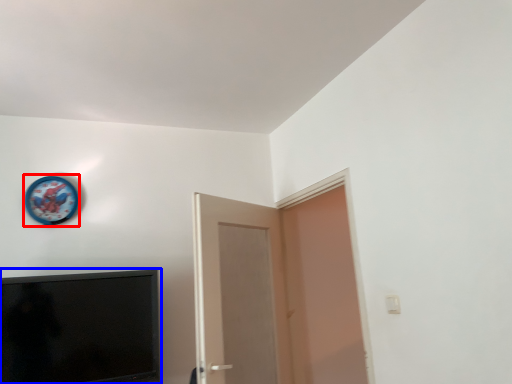
Question: Which object appears closest to the camera in this image, clock (highlighted by a red box) or television (highlighted by a blue box)?

Choices:
 (A) clock
 (B) television

Answer: (B)